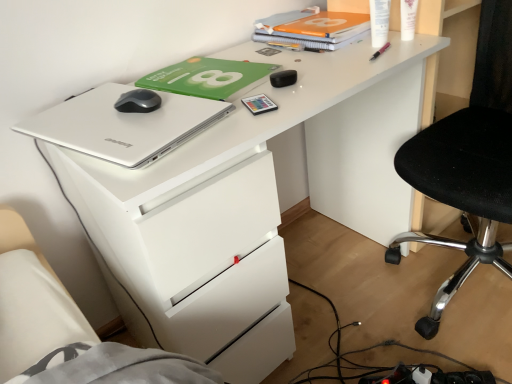
Locate an element on the screen. The image size is (512, 384). vacant space that is in between white plastic bottle at upper right, which is counted as the fourth stationery, starting from the bottom, and black matte earbuds at center, the second stationery ordered from the bottom is located at coordinates (332, 62).